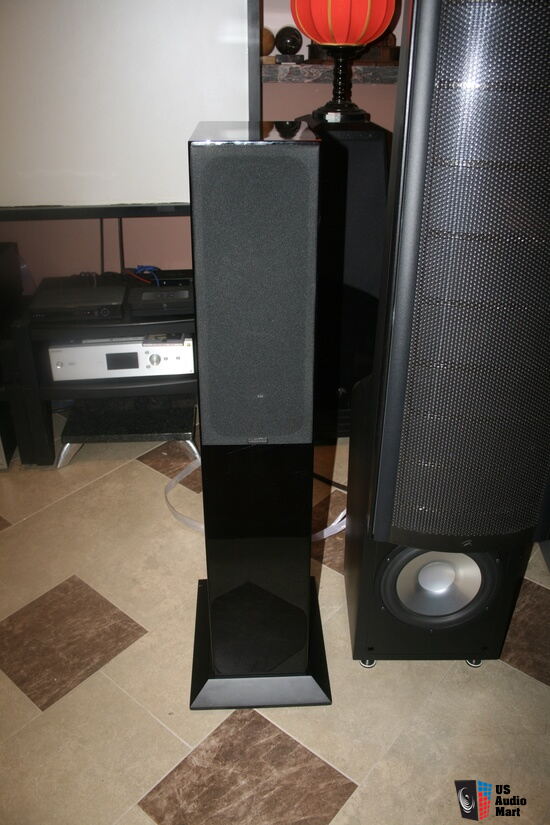
Where is `speaker base`? The width and height of the screenshot is (550, 825). speaker base is located at coordinates (301, 682).